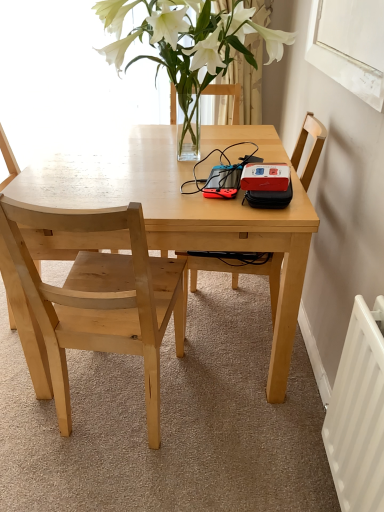
Locate an element on the screen. light wood table at center is located at coordinates (178, 213).

Find the location of a particular element. This screenshot has height=512, width=384. light wood chair at left, positioned as the 2th chair in left-to-right order is located at coordinates (101, 300).

What is the approximate width of light wood chair at left, the 2th chair viewed from the right?

light wood chair at left, the 2th chair viewed from the right, is 21.19 inches wide.

What is the approximate height of translucent glass vase at upper center?

The height of translucent glass vase at upper center is 19.48 inches.

The height and width of the screenshot is (512, 384). I want to click on translucent glass vase at upper center, so click(x=191, y=41).

This screenshot has width=384, height=512. What do you see at coordinates (312, 147) in the screenshot?
I see `wooden chair at center, the 3th chair in the left-to-right sequence` at bounding box center [312, 147].

Image resolution: width=384 pixels, height=512 pixels. Find the location of `natural wood chair at left, which appears as the third chair when viewed from the right`. natural wood chair at left, which appears as the third chair when viewed from the right is located at coordinates (7, 159).

How different are the orientations of translucent glass vase at upper center and wooden chair at center, the 3th chair in the left-to-right sequence, in degrees?

The facing directions of translucent glass vase at upper center and wooden chair at center, the 3th chair in the left-to-right sequence, are 4.15 degrees apart.

From the image's perspective, is translucent glass vase at upper center beneath wooden chair at center, the 1th chair in the right-to-left sequence?

No.

Would you say translucent glass vase at upper center is inside or outside wooden chair at center, the 3th chair in the left-to-right sequence?

translucent glass vase at upper center exists outside the volume of wooden chair at center, the 3th chair in the left-to-right sequence.

Does translucent glass vase at upper center have a smaller size compared to wooden chair at center, the 3th chair in the left-to-right sequence?

Actually, translucent glass vase at upper center might be larger than wooden chair at center, the 3th chair in the left-to-right sequence.

Is light wood chair at left, positioned as the 2th chair in left-to-right order, oriented away from natural wood chair at left, which appears as the third chair when viewed from the right?

No, light wood chair at left, positioned as the 2th chair in left-to-right order,'s orientation is not away from natural wood chair at left, which appears as the third chair when viewed from the right.

Is light wood chair at left, positioned as the 2th chair in left-to-right order, shorter than natural wood chair at left, which is counted as the 1th chair, starting from the left?

Yes.

Does light wood chair at left, the 2th chair viewed from the right, have a greater width compared to natural wood chair at left, which appears as the third chair when viewed from the right?

Indeed, light wood chair at left, the 2th chair viewed from the right, has a greater width compared to natural wood chair at left, which appears as the third chair when viewed from the right.

Considering the positions of objects light wood chair at left, positioned as the 2th chair in left-to-right order, and natural wood chair at left, which is counted as the 1th chair, starting from the left, in the image provided, who is more to the right, light wood chair at left, positioned as the 2th chair in left-to-right order, or natural wood chair at left, which is counted as the 1th chair, starting from the left,?

From the viewer's perspective, light wood chair at left, positioned as the 2th chair in left-to-right order, appears more on the right side.

Looking at this image, does natural wood chair at left, which appears as the third chair when viewed from the right, have a smaller size compared to wooden chair at center, the 3th chair in the left-to-right sequence?

No.

Looking at this image, considering the relative positions of natural wood chair at left, which appears as the third chair when viewed from the right, and wooden chair at center, the 3th chair in the left-to-right sequence, in the image provided, is natural wood chair at left, which appears as the third chair when viewed from the right, behind wooden chair at center, the 3th chair in the left-to-right sequence,?

Yes, natural wood chair at left, which appears as the third chair when viewed from the right, is further from the viewer.

Identify the location of chair that is the 2nd object to the left of the wooden chair at center, the 3th chair in the left-to-right sequence, starting at the anchor. The image size is (384, 512). (7, 159).

From the image's perspective, is natural wood chair at left, which is counted as the 1th chair, starting from the left, positioned above or below wooden chair at center, the 3th chair in the left-to-right sequence?

Clearly, from the image's perspective, natural wood chair at left, which is counted as the 1th chair, starting from the left, is above wooden chair at center, the 3th chair in the left-to-right sequence.

Does white matte window screen at upper right have a lesser width compared to natural wood chair at left, which appears as the third chair when viewed from the right?

Correct, the width of white matte window screen at upper right is less than that of natural wood chair at left, which appears as the third chair when viewed from the right.

Does white matte window screen at upper right turn towards natural wood chair at left, which is counted as the 1th chair, starting from the left?

No, white matte window screen at upper right is not turned towards natural wood chair at left, which is counted as the 1th chair, starting from the left.

How much distance is there between white matte window screen at upper right and natural wood chair at left, which is counted as the 1th chair, starting from the left?

white matte window screen at upper right and natural wood chair at left, which is counted as the 1th chair, starting from the left, are 3.88 feet apart.

Based on the photo, is white matte window screen at upper right with natural wood chair at left, which appears as the third chair when viewed from the right?

No, white matte window screen at upper right is not touching natural wood chair at left, which appears as the third chair when viewed from the right.

Considering the positions of objects wooden chair at center, the 1th chair in the right-to-left sequence, and white matte window screen at upper right in the image provided, who is more to the right, wooden chair at center, the 1th chair in the right-to-left sequence, or white matte window screen at upper right?

Positioned to the right is white matte window screen at upper right.

Is wooden chair at center, the 1th chair in the right-to-left sequence, with white matte window screen at upper right?

No, wooden chair at center, the 1th chair in the right-to-left sequence, is not making contact with white matte window screen at upper right.

Which of these two, wooden chair at center, the 3th chair in the left-to-right sequence, or white matte window screen at upper right, stands shorter?

Standing shorter between the two is white matte window screen at upper right.

Is light wood chair at left, positioned as the 2th chair in left-to-right order, facing towards light wood table at center?

Yes.

This screenshot has height=512, width=384. Identify the location of kitchen & dining room table that is behind the light wood chair at left, the 2th chair viewed from the right. (178, 213).

Consider the image. From a real-world perspective, which object rests below the other?

light wood table at center is physically lower.

Find the location of a particular element. The height and width of the screenshot is (512, 384). kitchen & dining room table on the right of natural wood chair at left, which appears as the third chair when viewed from the right is located at coordinates (178, 213).

Are natural wood chair at left, which appears as the third chair when viewed from the right, and light wood table at center making contact?

No, natural wood chair at left, which appears as the third chair when viewed from the right, is not making contact with light wood table at center.

Considering the positions of points (2, 129) and (276, 350), is point (2, 129) farther from camera compared to point (276, 350)?

Yes.

Does natural wood chair at left, which appears as the third chair when viewed from the right, have a lesser width compared to light wood table at center?

Yes.

Locate an element on the screen. The height and width of the screenshot is (512, 384). chair on the right side of translucent glass vase at upper center is located at coordinates (312, 147).

You are a GUI agent. You are given a task and a screenshot of the screen. Output one action in this format:
    pyautogui.click(x=<x>, y=<y>)
    Task: Click on the chair to the left of light wood chair at left, positioned as the 2th chair in left-to-right order
    
    Given the screenshot: What is the action you would take?
    pyautogui.click(x=7, y=159)

Which object lies further to the anchor point light wood chair at left, the 2th chair viewed from the right, natural wood chair at left, which appears as the third chair when viewed from the right, or wooden chair at center, the 3th chair in the left-to-right sequence?

Among the two, wooden chair at center, the 3th chair in the left-to-right sequence, is located further to light wood chair at left, the 2th chair viewed from the right.

Which object lies further to the anchor point white matte window screen at upper right, translucent glass vase at upper center or natural wood chair at left, which is counted as the 1th chair, starting from the left?

natural wood chair at left, which is counted as the 1th chair, starting from the left.

Consider the image. Based on their spatial positions, is light wood table at center or wooden chair at center, the 3th chair in the left-to-right sequence, closer to translucent glass vase at upper center?

light wood table at center.

Based on the photo, from the image, which object appears to be nearer to wooden chair at center, the 1th chair in the right-to-left sequence, white matte window screen at upper right or light wood chair at left, positioned as the 2th chair in left-to-right order?

white matte window screen at upper right is positioned closer to the anchor wooden chair at center, the 1th chair in the right-to-left sequence.

From the image, which object appears to be nearer to wooden chair at center, the 3th chair in the left-to-right sequence, white metal radiator at lower right or white matte window screen at upper right?

Among the two, white matte window screen at upper right is located nearer to wooden chair at center, the 3th chair in the left-to-right sequence.

Considering their positions, is light wood table at center positioned closer to white matte window screen at upper right than wooden chair at center, the 3th chair in the left-to-right sequence?

Based on the image, wooden chair at center, the 3th chair in the left-to-right sequence, appears to be nearer to white matte window screen at upper right.

From the image, which object appears to be farther from translucent glass vase at upper center, natural wood chair at left, which is counted as the 1th chair, starting from the left, or white matte window screen at upper right?

The object further to translucent glass vase at upper center is natural wood chair at left, which is counted as the 1th chair, starting from the left.

Which object lies further to the anchor point white matte window screen at upper right, wooden chair at center, the 3th chair in the left-to-right sequence, or light wood chair at left, positioned as the 2th chair in left-to-right order?

Based on the image, light wood chair at left, positioned as the 2th chair in left-to-right order, appears to be further to white matte window screen at upper right.

Locate an element on the screen. The width and height of the screenshot is (384, 512). kitchen & dining room table between white matte window screen at upper right and white metal radiator at lower right vertically is located at coordinates (178, 213).

This screenshot has width=384, height=512. In order to click on houseplant located between natural wood chair at left, which is counted as the 1th chair, starting from the left, and white matte window screen at upper right in the left-right direction in this screenshot , I will do `click(191, 41)`.

You are a GUI agent. You are given a task and a screenshot of the screen. Output one action in this format:
    pyautogui.click(x=<x>, y=<y>)
    Task: Click on the kitchen & dining room table between translucent glass vase at upper center and light wood chair at left, positioned as the 2th chair in left-to-right order, vertically
    This screenshot has width=384, height=512.
    Given the screenshot: What is the action you would take?
    pyautogui.click(x=178, y=213)

The width and height of the screenshot is (384, 512). Identify the location of houseplant between white matte window screen at upper right and wooden chair at center, the 3th chair in the left-to-right sequence, vertically. (191, 41).